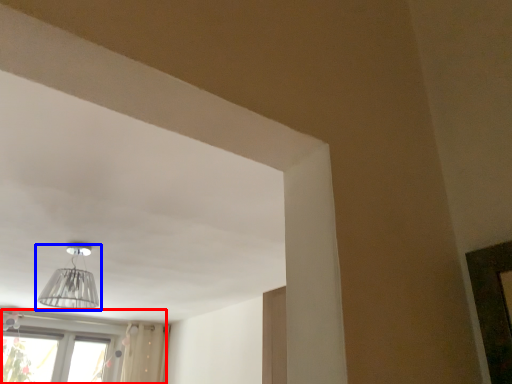
Question: Which object appears closest to the camera in this image, window (highlighted by a red box) or lamp (highlighted by a blue box)?

Choices:
 (A) window
 (B) lamp

Answer: (B)